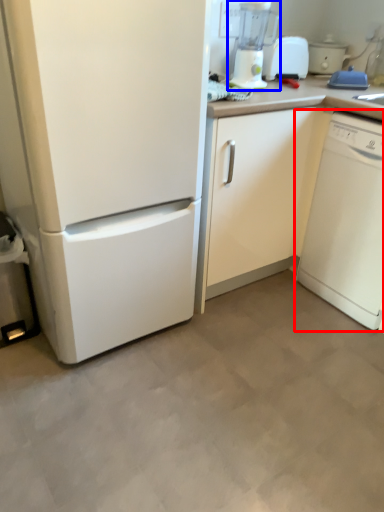
Question: Which point is closer to the camera, dish washer (highlighted by a red box) or blender (highlighted by a blue box)?

Choices:
 (A) dish washer
 (B) blender

Answer: (A)